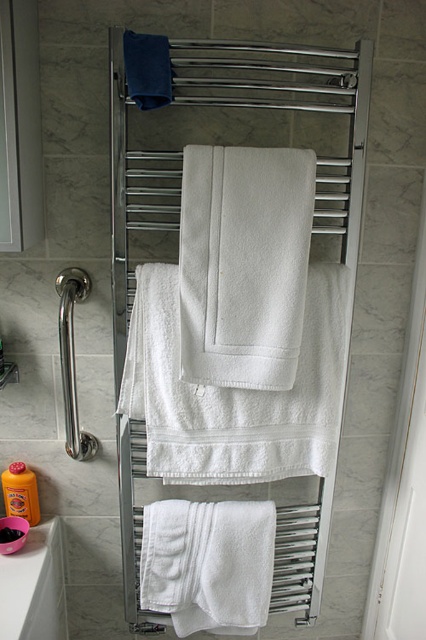
You are standing in the bathroom and want to grab the white cotton towel at center. However, you notice the white ceramic sink at lower left is in your way. Can you reach the towel without moving the sink?

The white cotton towel at center is further to the viewer than the white ceramic sink at lower left, meaning the sink is closer to you. Since the sink is between you and the towel, you would need to move the sink to reach the towel.

You are standing in the bathroom and want to reach the point at coordinates point [192,225]. You have a 3.5 feet long stick. Can you touch the point with the stick?

The distance between you and the point [192,225] is 3.55 feet, and the stick is 3.5 feet long. Since the stick is slightly shorter than the distance, you cannot reach the point with the stick.